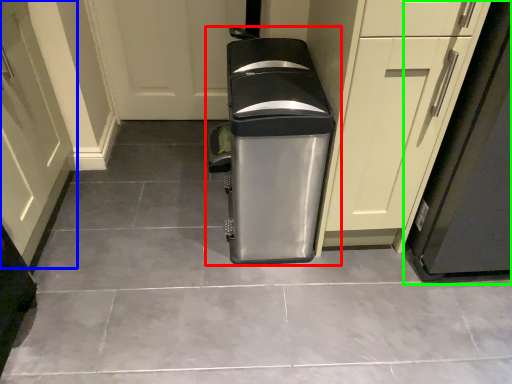
Question: Which object is the closest to the waste container (highlighted by a red box)? Choose among these: door (highlighted by a blue box) or appliance (highlighted by a green box).

Choices:
 (A) door
 (B) appliance

Answer: (B)